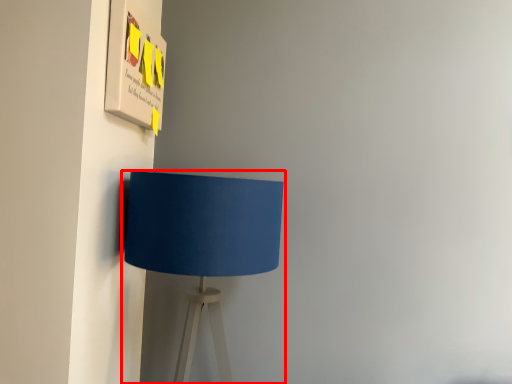
Question: From the image's perspective, what is the correct spatial relationship of lamp (annotated by the red box) in relation to poster?

Choices:
 (A) above
 (B) below

Answer: (B)